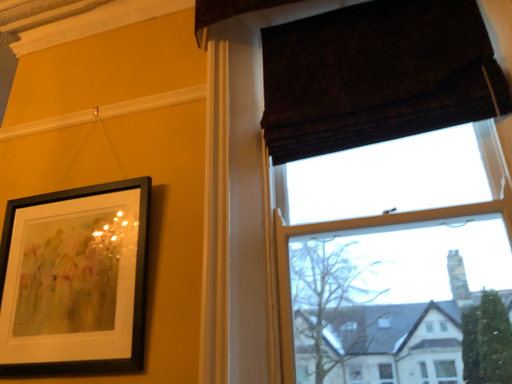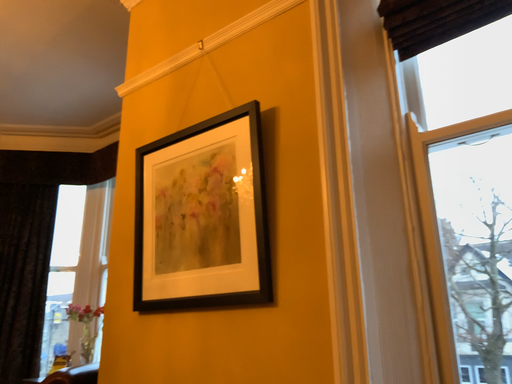
Question: Which way did the camera rotate in the video?

Choices:
 (A) rotated downward
 (B) rotated upward

Answer: (A)